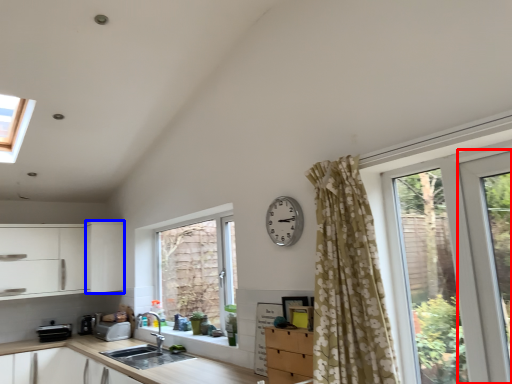
Question: Among these objects, which one is farthest to the camera, screen door (highlighted by a red box) or cabinetry (highlighted by a blue box)?

Choices:
 (A) screen door
 (B) cabinetry

Answer: (B)